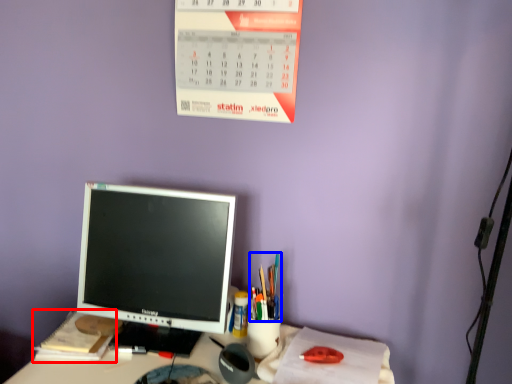
Question: Among these objects, which one is farthest to the camera, notebook (highlighted by a red box) or stationery (highlighted by a blue box)?

Choices:
 (A) notebook
 (B) stationery

Answer: (A)